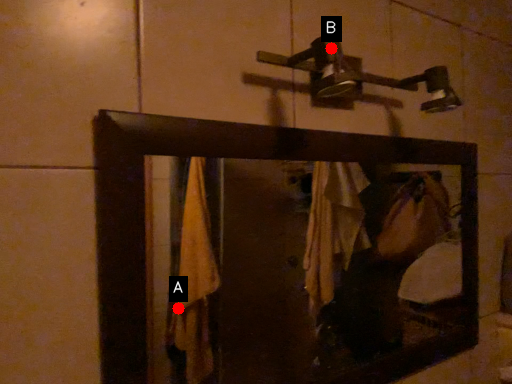
Question: Two points are circled on the image, labeled by A and B beside each circle. Which of the following is the farthest from the observer?

Choices:
 (A) A is further
 (B) B is further

Answer: (A)